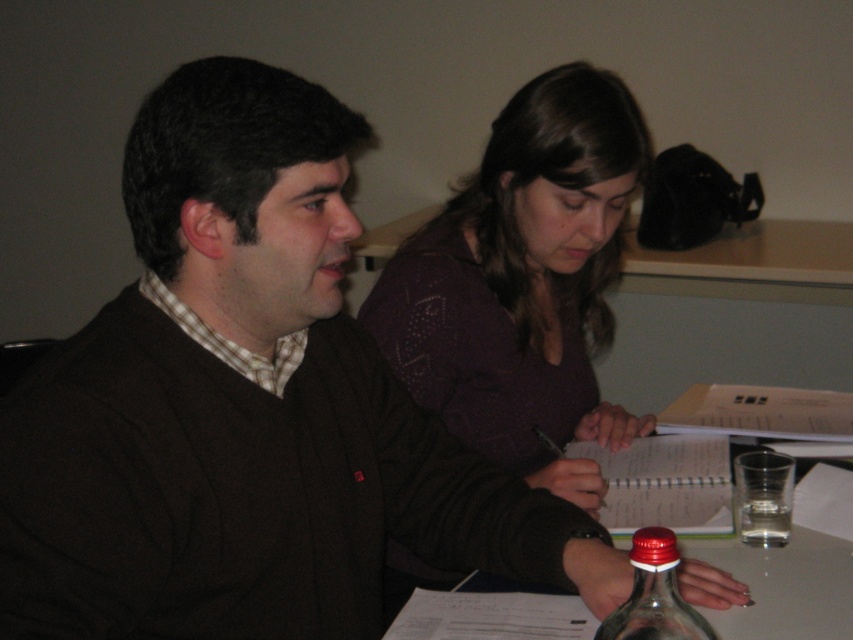
Question: Does clear glass table at center appear on the left side of transparent glass bottle at center?

Choices:
 (A) yes
 (B) no

Answer: (B)

Question: Which object is positioned closest to the clear glass table at center?

Choices:
 (A) purple dotted sweater at upper center
 (B) transparent glass bottle at center

Answer: (B)

Question: Considering the real-world distances, which object is closest to the transparent glass bottle at center?

Choices:
 (A) clear glass table at center
 (B) purple dotted sweater at upper center

Answer: (A)

Question: Where is purple dotted sweater at upper center located in relation to clear glass table at center in the image?

Choices:
 (A) below
 (B) above

Answer: (B)

Question: Considering the relative positions of clear glass table at center and transparent glass bottle at center in the image provided, where is clear glass table at center located with respect to transparent glass bottle at center?

Choices:
 (A) right
 (B) left

Answer: (A)

Question: Which object appears farthest from the camera in this image?

Choices:
 (A) purple dotted sweater at upper center
 (B) transparent glass bottle at center
 (C) clear glass table at center

Answer: (A)